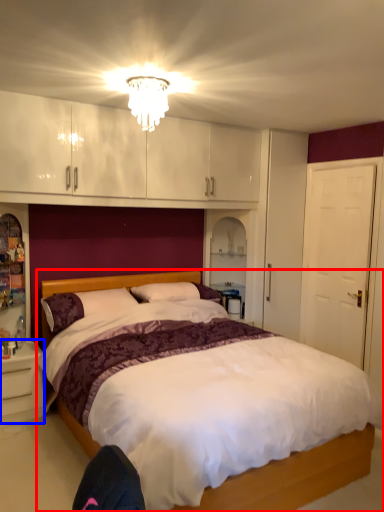
Question: Among these objects, which one is farthest to the camera, bed (highlighted by a red box) or nightstand (highlighted by a blue box)?

Choices:
 (A) bed
 (B) nightstand

Answer: (B)